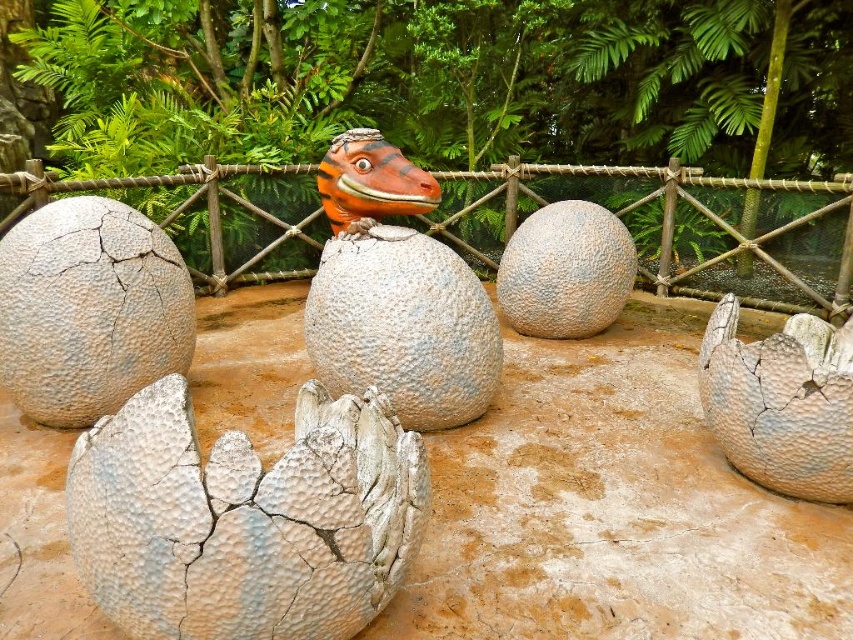
Question: Which object is farther from the camera taking this photo?

Choices:
 (A) cracked stone egg at center
 (B) gray cracked egg at center

Answer: (B)

Question: Where is gray cracked egg at center located in relation to shiny orange dinosaur head at center in the image?

Choices:
 (A) left
 (B) right

Answer: (A)

Question: Considering the relative positions of cracked stone egg at center and gray textured egg at center in the image provided, where is cracked stone egg at center located with respect to gray textured egg at center?

Choices:
 (A) right
 (B) left

Answer: (A)

Question: Which object is positioned closest to the cracked stone egg at center?

Choices:
 (A) rope mesh at center
 (B) white cracked egg at center

Answer: (B)

Question: Observing the image, what is the correct spatial positioning of white cracked egg at center in reference to gray cracked egg at center?

Choices:
 (A) right
 (B) left

Answer: (A)

Question: Which point appears farthest from the camera in this image?

Choices:
 (A) (389, 397)
 (B) (596, 224)

Answer: (B)